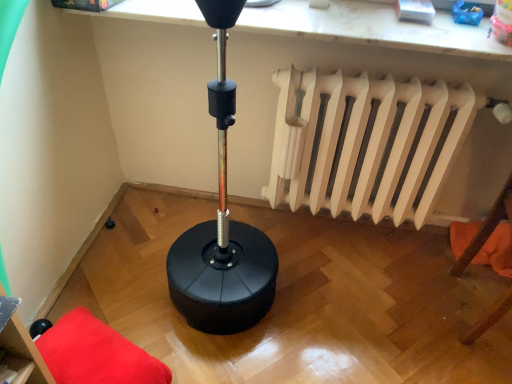
Find the location of `black rubber punching bag at upper center`. black rubber punching bag at upper center is located at coordinates (373, 28).

The height and width of the screenshot is (384, 512). What are the coordinates of `orange fabric pillow at lower right` in the screenshot? It's located at (497, 251).

Locate an element on the screen. This screenshot has height=384, width=512. matte black stool at lower left, the first furniture positioned from the front is located at coordinates (20, 351).

This screenshot has height=384, width=512. Identify the location of black rubber punching bag at upper center. (373, 28).

Which object is positioned more to the right, black rubber punching bag at upper center or velvet red cushion at lower left, marked as the second furniture in a top-to-bottom arrangement?

Positioned to the right is black rubber punching bag at upper center.

Do you think black rubber punching bag at upper center is within velvet red cushion at lower left, marked as the second furniture in a top-to-bottom arrangement, or outside of it?

black rubber punching bag at upper center lies outside velvet red cushion at lower left, marked as the second furniture in a top-to-bottom arrangement.

Are black rubber punching bag at upper center and velvet red cushion at lower left, placed as the 1th furniture when sorted from back to front, beside each other?

No, black rubber punching bag at upper center is not beside velvet red cushion at lower left, placed as the 1th furniture when sorted from back to front.

Which object is thinner, black rubber punching bag at upper center or velvet red cushion at lower left, placed as the 1th furniture when sorted from back to front?

black rubber punching bag at upper center is thinner.

Can you tell me how much velvet red cushion at lower left, which is the second furniture from front to back, and black rubber punching bag at upper center differ in facing direction?

They differ by 114 degrees in their facing directions.

In the scene shown: Between velvet red cushion at lower left, placed as the 1th furniture when sorted from back to front, and black rubber punching bag at upper center, which one has more height?

velvet red cushion at lower left, placed as the 1th furniture when sorted from back to front, is taller.

Which of these two, velvet red cushion at lower left, marked as the second furniture in a top-to-bottom arrangement, or black rubber punching bag at upper center, is bigger?

Bigger between the two is black rubber punching bag at upper center.

Is velvet red cushion at lower left, which is the second furniture from front to back, in front of black rubber punching bag at upper center?

Yes, velvet red cushion at lower left, which is the second furniture from front to back, is in front of black rubber punching bag at upper center.

Is orange fabric pillow at lower right facing away from velvet red cushion at lower left, which is the second furniture from front to back?

orange fabric pillow at lower right does not have its back to velvet red cushion at lower left, which is the second furniture from front to back.

Considering the positions of point (469, 240) and point (52, 345), is point (469, 240) closer or farther from the camera than point (52, 345)?

Point (469, 240) is farther from the camera than point (52, 345).

Is orange fabric pillow at lower right inside or outside of velvet red cushion at lower left, placed as the 1th furniture when sorted from back to front?

orange fabric pillow at lower right is outside velvet red cushion at lower left, placed as the 1th furniture when sorted from back to front.

How different are the orientations of orange fabric pillow at lower right and velvet red cushion at lower left, which is the second furniture from front to back, in degrees?

The angular difference between orange fabric pillow at lower right and velvet red cushion at lower left, which is the second furniture from front to back, is 113 degrees.

From the image's perspective, does matte black stool at lower left, the 1th furniture positioned from the top, appear lower than orange fabric pillow at lower right?

Yes, from the image's perspective, matte black stool at lower left, the 1th furniture positioned from the top, is beneath orange fabric pillow at lower right.

Can you tell me how much matte black stool at lower left, the 1th furniture positioned from the top, and orange fabric pillow at lower right differ in facing direction?

The facing directions of matte black stool at lower left, the 1th furniture positioned from the top, and orange fabric pillow at lower right are 92.6 degrees apart.

Is matte black stool at lower left, the second furniture in the back-to-front sequence, beside orange fabric pillow at lower right?

No, matte black stool at lower left, the second furniture in the back-to-front sequence, is not next to orange fabric pillow at lower right.

Considering the relative sizes of matte black stool at lower left, the second furniture in the back-to-front sequence, and orange fabric pillow at lower right in the image provided, is matte black stool at lower left, the second furniture in the back-to-front sequence, wider than orange fabric pillow at lower right?

Correct, the width of matte black stool at lower left, the second furniture in the back-to-front sequence, exceeds that of orange fabric pillow at lower right.

Is black rubber punching bag at upper center a part of matte black stool at lower left, marked as the 2th furniture in a bottom-to-top arrangement?

No, black rubber punching bag at upper center is not inside matte black stool at lower left, marked as the 2th furniture in a bottom-to-top arrangement.

Identify the location of computer above the matte black stool at lower left, the first furniture positioned from the front (from the image's perspective). (373, 28).

Based on the photo, is matte black stool at lower left, the first furniture positioned from the front, far from black rubber punching bag at upper center?

Yes, matte black stool at lower left, the first furniture positioned from the front, is far from black rubber punching bag at upper center.

Considering the relative sizes of matte black stool at lower left, marked as the 2th furniture in a bottom-to-top arrangement, and black rubber punching bag at upper center in the image provided, is matte black stool at lower left, marked as the 2th furniture in a bottom-to-top arrangement, taller than black rubber punching bag at upper center?

No, matte black stool at lower left, marked as the 2th furniture in a bottom-to-top arrangement, is not taller than black rubber punching bag at upper center.

Where is `furniture that is the 2nd one when counting leftward from the orange fabric pillow at lower right`? furniture that is the 2nd one when counting leftward from the orange fabric pillow at lower right is located at coordinates (20, 351).

How many degrees apart are the facing directions of orange fabric pillow at lower right and matte black stool at lower left, the second furniture in the back-to-front sequence?

The angular difference between orange fabric pillow at lower right and matte black stool at lower left, the second furniture in the back-to-front sequence, is 92.6 degrees.

From a real-world perspective, which is physically below, orange fabric pillow at lower right or matte black stool at lower left, the 1th furniture positioned from the top?

From a 3D spatial view, orange fabric pillow at lower right is below.

Which object is thinner, orange fabric pillow at lower right or matte black stool at lower left, marked as the 2th furniture in a bottom-to-top arrangement?

orange fabric pillow at lower right is thinner.

Considering the relative positions of white matte radiator at upper right and velvet red cushion at lower left, placed as the 1th furniture when sorted from back to front, in the image provided, is white matte radiator at upper right to the left or to the right of velvet red cushion at lower left, placed as the 1th furniture when sorted from back to front,?

white matte radiator at upper right is positioned on velvet red cushion at lower left, placed as the 1th furniture when sorted from back to front,'s right side.

In the scene shown: Is white matte radiator at upper right taller than velvet red cushion at lower left, which is the second furniture from front to back?

Indeed, white matte radiator at upper right has a greater height compared to velvet red cushion at lower left, which is the second furniture from front to back.

Which is behind, point (278, 72) or point (160, 365)?

Positioned behind is point (278, 72).

Looking at this image, considering their positions, is white matte radiator at upper right located in front of or behind velvet red cushion at lower left, marked as the second furniture in a top-to-bottom arrangement?

Clearly, white matte radiator at upper right is behind velvet red cushion at lower left, marked as the second furniture in a top-to-bottom arrangement.

Image resolution: width=512 pixels, height=384 pixels. Identify the location of the 1st furniture to the left of the black rubber punching bag at upper center, counting from the anchor's position. (96, 353).

The height and width of the screenshot is (384, 512). What are the coordinates of `computer on the right of the velvet red cushion at lower left, placed as the 1th furniture when sorted from back to front` in the screenshot? It's located at (x=373, y=28).

Considering their positions, is velvet red cushion at lower left, which is the second furniture from front to back, positioned further to matte black stool at lower left, the 1th furniture positioned from the top, than orange fabric pillow at lower right?

orange fabric pillow at lower right is positioned further to the anchor matte black stool at lower left, the 1th furniture positioned from the top.

From the image, which object appears to be nearer to black rubber punching bag at upper center, velvet red cushion at lower left, positioned as the 1th furniture in bottom-to-top order, or matte black stool at lower left, the first furniture positioned from the front?

Based on the image, velvet red cushion at lower left, positioned as the 1th furniture in bottom-to-top order, appears to be nearer to black rubber punching bag at upper center.

When comparing their distances from matte black stool at lower left, the second furniture in the back-to-front sequence, does black rubber punching bag at upper center or white matte radiator at upper right seem further?

black rubber punching bag at upper center is positioned further to the anchor matte black stool at lower left, the second furniture in the back-to-front sequence.

Which object lies further to the anchor point velvet red cushion at lower left, positioned as the 1th furniture in bottom-to-top order, white matte radiator at upper right or orange fabric pillow at lower right?

orange fabric pillow at lower right.

Which object lies nearer to the anchor point matte black stool at lower left, the 1th furniture positioned from the top, white matte radiator at upper right or velvet red cushion at lower left, positioned as the 1th furniture in bottom-to-top order?

velvet red cushion at lower left, positioned as the 1th furniture in bottom-to-top order, is closer to matte black stool at lower left, the 1th furniture positioned from the top.

In the scene shown: Considering their positions, is white matte radiator at upper right positioned further to velvet red cushion at lower left, positioned as the 1th furniture in bottom-to-top order, than matte black stool at lower left, the second furniture in the back-to-front sequence?

Based on the image, white matte radiator at upper right appears to be further to velvet red cushion at lower left, positioned as the 1th furniture in bottom-to-top order.

Considering their positions, is matte black stool at lower left, the first furniture positioned from the front, positioned further to white matte radiator at upper right than black rubber punching bag at upper center?

Based on the image, matte black stool at lower left, the first furniture positioned from the front, appears to be further to white matte radiator at upper right.

Considering their positions, is matte black stool at lower left, the second furniture in the back-to-front sequence, positioned further to orange fabric pillow at lower right than white matte radiator at upper right?

The object further to orange fabric pillow at lower right is matte black stool at lower left, the second furniture in the back-to-front sequence.

The image size is (512, 384). What are the coordinates of `computer between matte black stool at lower left, the first furniture positioned from the front, and white matte radiator at upper right, in the horizontal direction` in the screenshot? It's located at (373, 28).

Where is `furniture between matte black stool at lower left, the first furniture positioned from the front, and white matte radiator at upper right`? The width and height of the screenshot is (512, 384). furniture between matte black stool at lower left, the first furniture positioned from the front, and white matte radiator at upper right is located at coordinates (96, 353).

This screenshot has width=512, height=384. I want to click on furniture between black rubber punching bag at upper center and velvet red cushion at lower left, marked as the second furniture in a top-to-bottom arrangement, in the vertical direction, so click(20, 351).

Where is `computer between matte black stool at lower left, the first furniture positioned from the front, and orange fabric pillow at lower right`? The image size is (512, 384). computer between matte black stool at lower left, the first furniture positioned from the front, and orange fabric pillow at lower right is located at coordinates (373, 28).